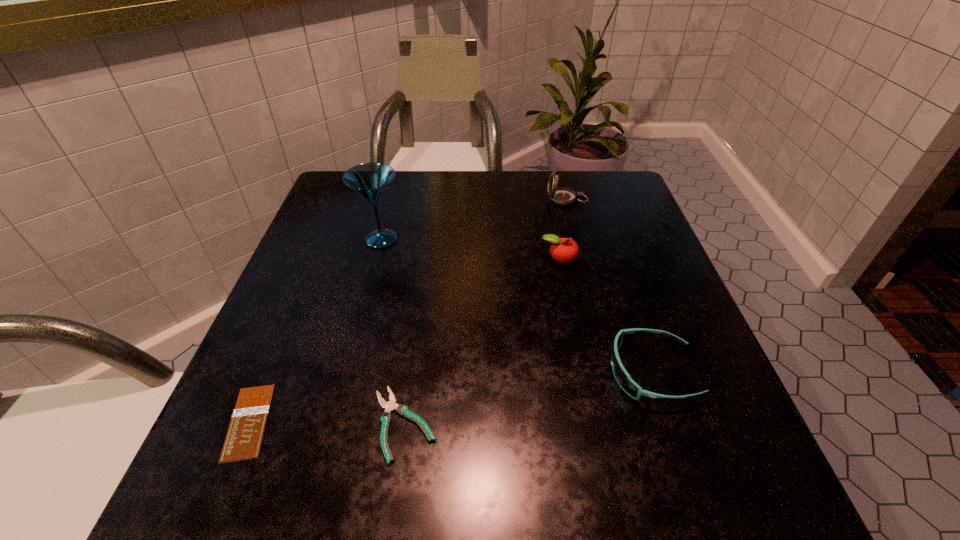
The height and width of the screenshot is (540, 960). I want to click on the tallest object, so click(x=370, y=180).

Where is `martini`? Image resolution: width=960 pixels, height=540 pixels. martini is located at coordinates (370, 180).

Where is `the farthest object`? The image size is (960, 540). the farthest object is located at coordinates (561, 196).

This screenshot has width=960, height=540. What are the coordinates of `compass` in the screenshot? It's located at (561, 196).

Locate an element on the screen. The height and width of the screenshot is (540, 960). apple is located at coordinates (563, 250).

You are a GUI agent. You are given a task and a screenshot of the screen. Output one action in this format:
    pyautogui.click(x=<x>, y=<y>)
    Task: Click on the sunglasses
    This screenshot has height=540, width=960.
    Given the screenshot: What is the action you would take?
    pyautogui.click(x=622, y=377)

Locate an element on the screen. The height and width of the screenshot is (540, 960). pliers is located at coordinates (386, 418).

The height and width of the screenshot is (540, 960). Identify the location of the fifth tallest object. (386, 418).

Locate an element on the screen. This screenshot has width=960, height=540. the shortest object is located at coordinates (243, 441).

You are a GUI agent. You are given a task and a screenshot of the screen. Output one action in this format:
    pyautogui.click(x=<x>, y=<y>)
    Task: Click on the chocolate bar
    
    Given the screenshot: What is the action you would take?
    pyautogui.click(x=243, y=441)